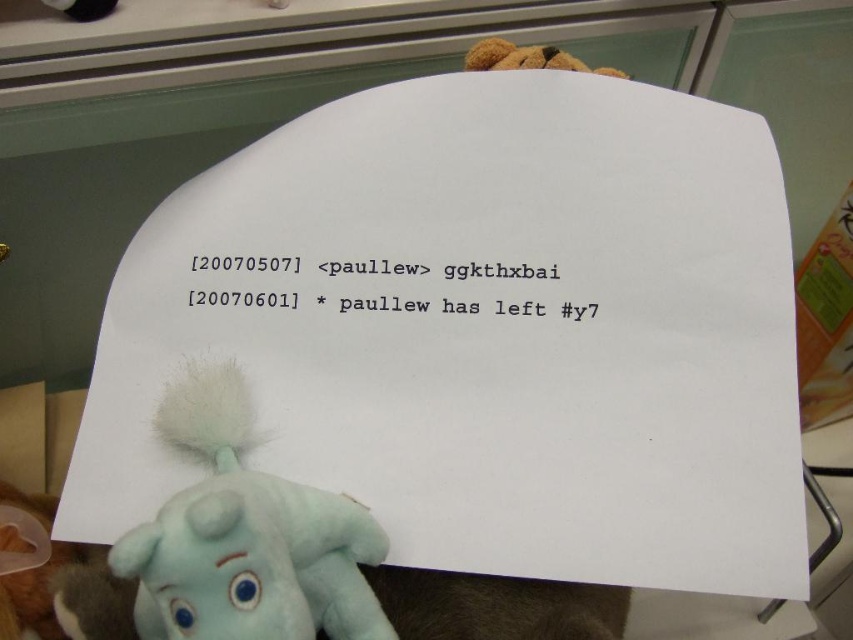
You are a photographer taking a picture of the brown plush bear at upper center and the blacktextured papernote at upper center. Which object will appear closer to the camera in the final photo?

The brown plush bear at upper center will appear closer to the camera in the final photo because the blacktextured papernote at upper center is positioned under it, meaning the bear is in front.